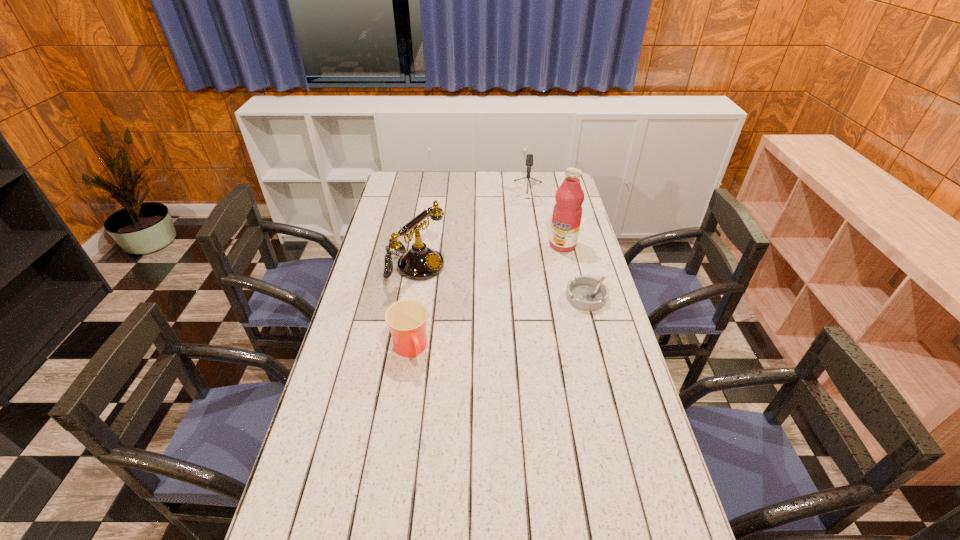
Identify the location of blank space that satisfies the following two spatial constraints: 1. on the front side of the shortest object; 2. on the right side of the fruit juice. This screenshot has height=540, width=960. click(575, 298).

In order to click on vacant point that satisfies the following two spatial constraints: 1. on the front side of the ashtray; 2. on the right side of the farthest object in this screenshot , I will do `click(541, 298)`.